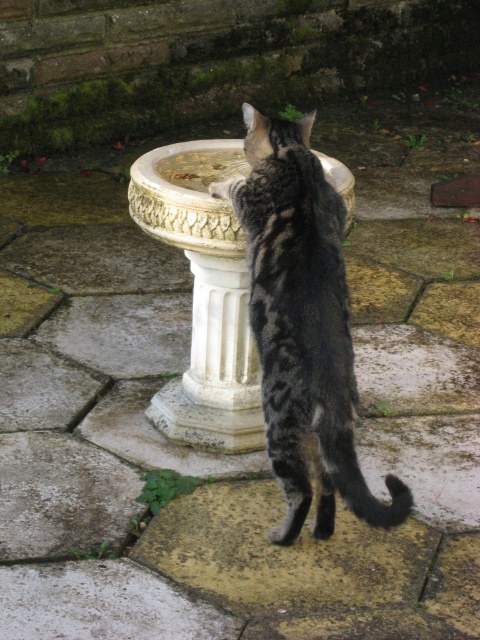
Question: Where is tabby fur cat at center located in relation to white marble pillar at center in the image?

Choices:
 (A) right
 (B) left

Answer: (A)

Question: Which point is closer to the camera?

Choices:
 (A) white marble pillar at center
 (B) tabby fur cat at center

Answer: (B)

Question: Where is tabby fur cat at center located in relation to white marble pillar at center in the image?

Choices:
 (A) below
 (B) above

Answer: (A)

Question: Is tabby fur cat at center above white marble pillar at center?

Choices:
 (A) no
 (B) yes

Answer: (A)

Question: Which point appears closest to the camera in this image?

Choices:
 (A) (140, 208)
 (B) (275, 456)

Answer: (B)